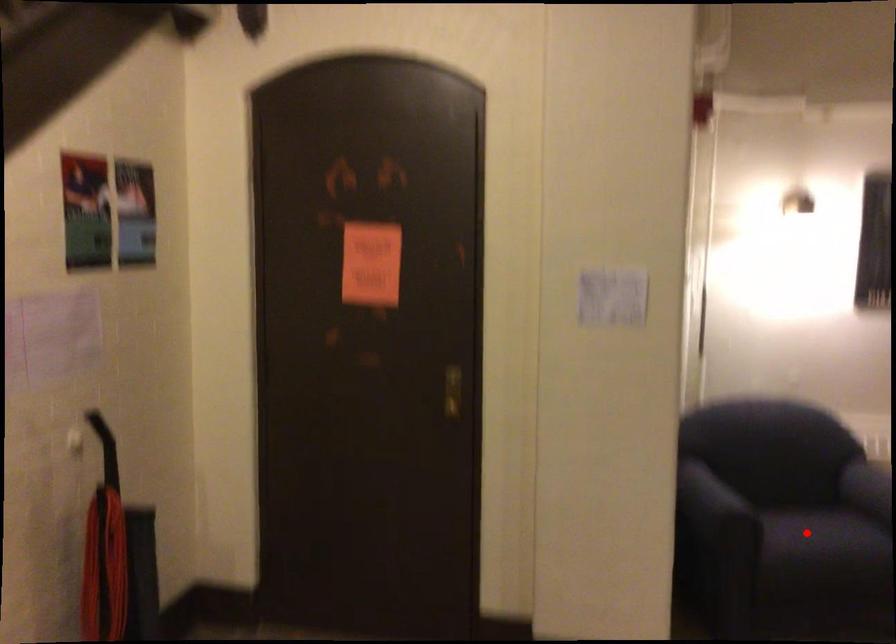
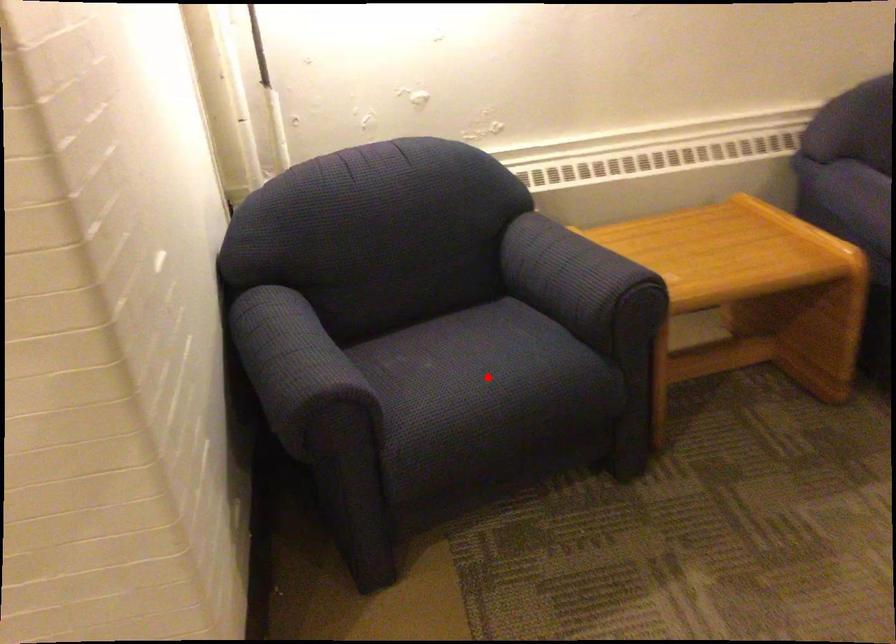
I am providing you with two images of the same scene from different viewpoints. A red point is marked on the first image and another point is marked on the second image. Does the point marked in image1 correspond to the same location as the one in image2?

Yes